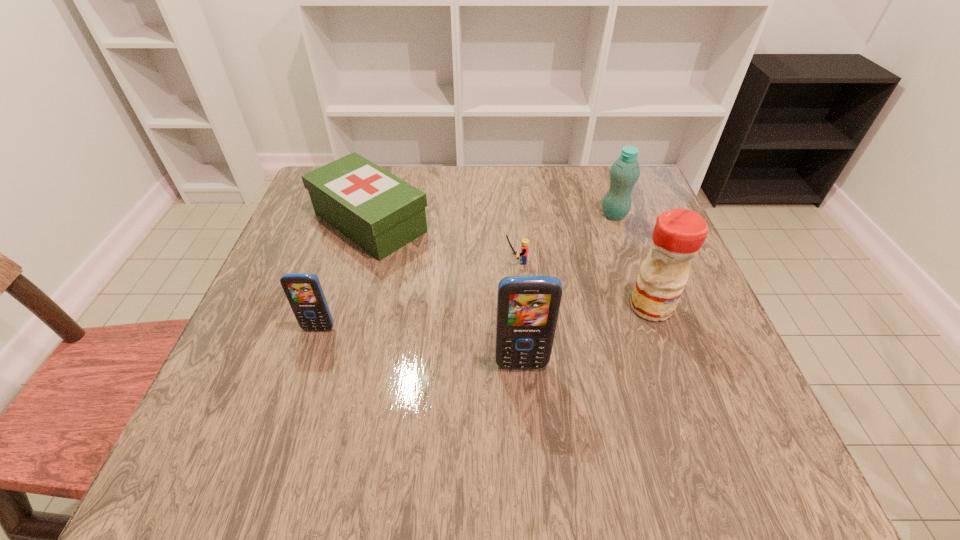
Where is `cellular telephone that is at the left edge`? This screenshot has height=540, width=960. cellular telephone that is at the left edge is located at coordinates [x=304, y=292].

The height and width of the screenshot is (540, 960). Identify the location of the first-aid kit that is positioned at the left edge. (380, 212).

Locate an element on the screen. This screenshot has height=540, width=960. water bottle at the right edge is located at coordinates (625, 171).

This screenshot has height=540, width=960. Find the location of `condiment situated at the right edge`. condiment situated at the right edge is located at coordinates (678, 235).

Where is `object present at the far left corner`? This screenshot has height=540, width=960. object present at the far left corner is located at coordinates (380, 212).

Locate an element on the screen. object that is at the far right corner is located at coordinates (625, 171).

Identify the location of free spot at the far edge of the desktop. This screenshot has height=540, width=960. (544, 197).

Where is `vacant space at the near edge`? vacant space at the near edge is located at coordinates (615, 400).

Where is `free spot at the left edge of the desktop`? The width and height of the screenshot is (960, 540). free spot at the left edge of the desktop is located at coordinates (246, 342).

Where is `free location at the right edge`? This screenshot has height=540, width=960. free location at the right edge is located at coordinates (642, 253).